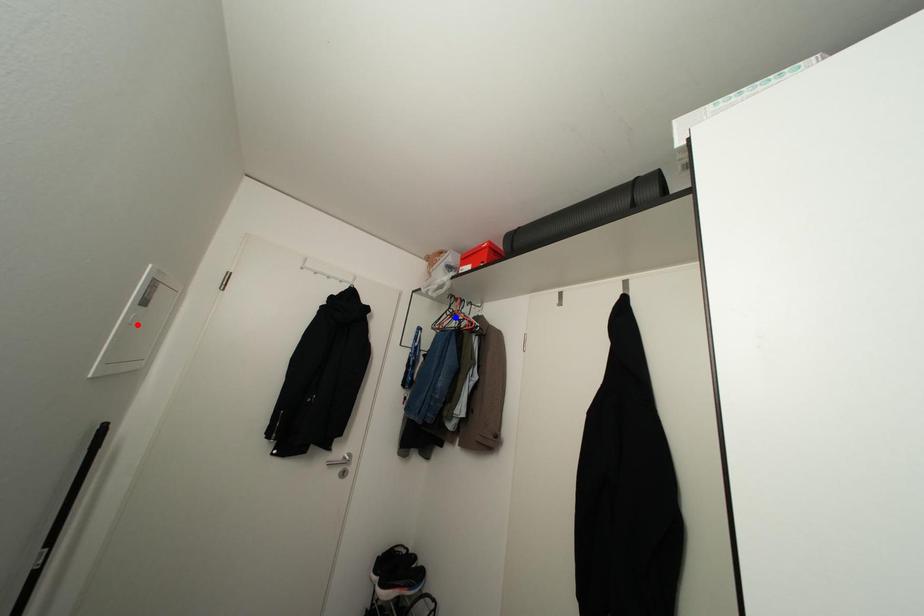
Question: Which of the two points in the image is closer to the camera?

Choices:
 (A) Blue point is closer.
 (B) Red point is closer.

Answer: (B)